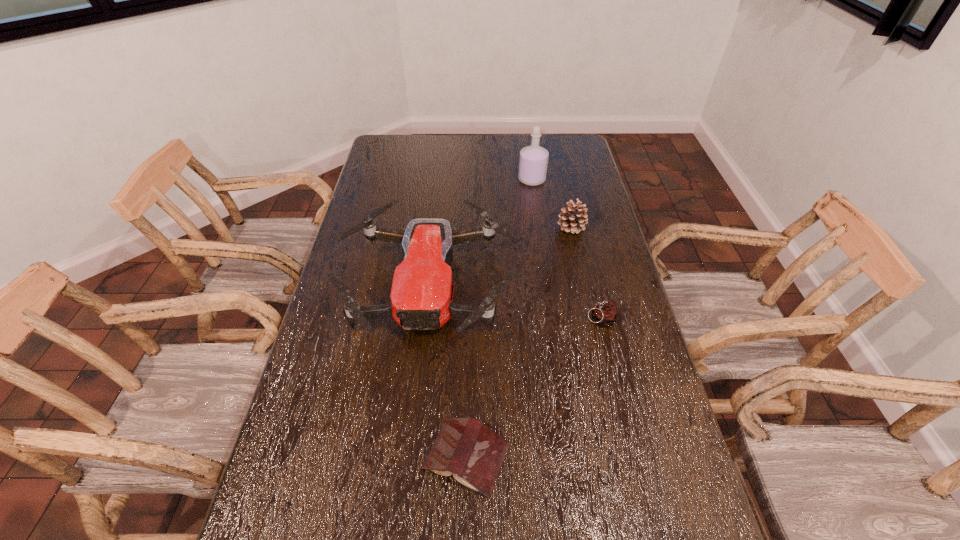
The image size is (960, 540). In order to click on the third object from left to right in this screenshot , I will do `click(533, 162)`.

Find the location of a particular element. This screenshot has width=960, height=540. perfume is located at coordinates (533, 162).

Locate an element on the screen. The width and height of the screenshot is (960, 540). drone is located at coordinates (421, 295).

You are a GUI agent. You are given a task and a screenshot of the screen. Output one action in this format:
    pyautogui.click(x=<x>, y=<y>)
    Task: Click on the third tallest object
    The image size is (960, 540).
    Given the screenshot: What is the action you would take?
    pyautogui.click(x=572, y=219)

Image resolution: width=960 pixels, height=540 pixels. I want to click on the farther pinecone, so point(572,219).

This screenshot has width=960, height=540. I want to click on the nearer pinecone, so click(x=605, y=312).

The width and height of the screenshot is (960, 540). In order to click on the fourth tallest object in this screenshot , I will do `click(605, 312)`.

You are a GUI agent. You are given a task and a screenshot of the screen. Output one action in this format:
    pyautogui.click(x=<x>, y=<y>)
    Task: Click on the nearest object
    
    Given the screenshot: What is the action you would take?
    pyautogui.click(x=466, y=447)

Find the location of a particular element. The image size is (960, 540). book is located at coordinates pyautogui.click(x=466, y=447).

Find the location of `vacant area situated on the back of the third object from left to right`. vacant area situated on the back of the third object from left to right is located at coordinates (527, 146).